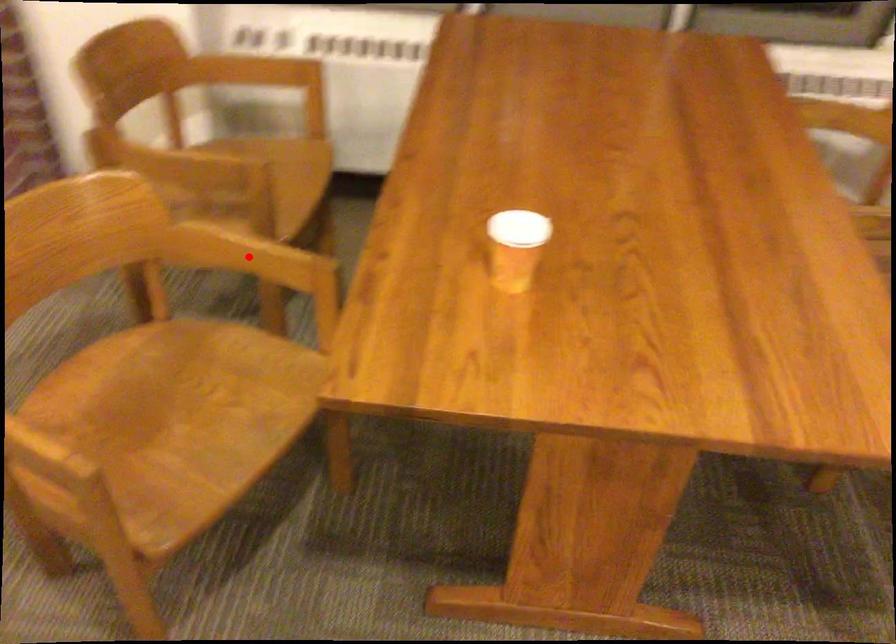
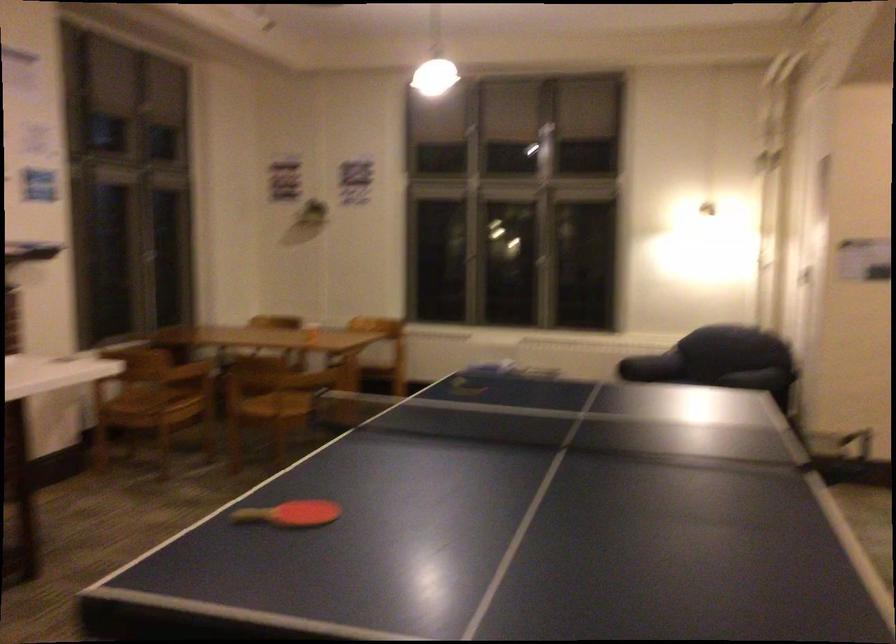
Question: I am providing you with two images of the same scene from different viewpoints. A red point is marked on the first image. Can you still see the location of the red point in image 2?

Choices:
 (A) Yes
 (B) No

Answer: (B)